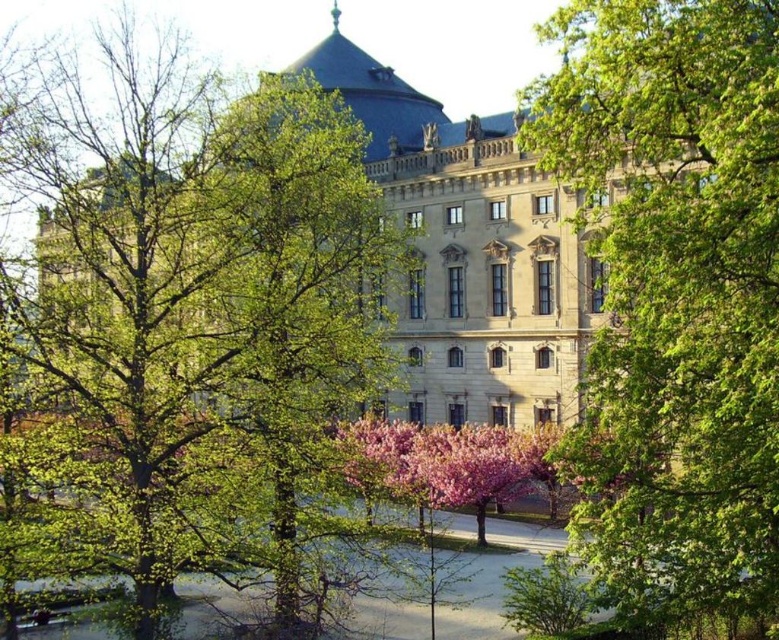
You are standing in front of the stone gray palace at center and want to take a photo of it. To avoid the green leafy tree at left from blocking the view, should you move to the right or left?

The green leafy tree at left is positioned on the left side of stone gray palace at center. To avoid the tree blocking the view, you should move to the right so that the tree moves out of frame to the left.

You are standing in a park and see the green leafy tree at left and the stone gray palace at center. Which object is closer to you?

The green leafy tree at left is closer to you because it is in front of the stone gray palace at center.

You are standing in front of the historic building and want to take a photo that includes both the central dome and the green leafy tree at center. Based on their positions, will the tree be in the foreground or background of the photo?

The green leafy tree at center is located at point (675, 292), which is in the foreground since it is closer to the viewer. Therefore, the tree will be in the foreground of the photo.